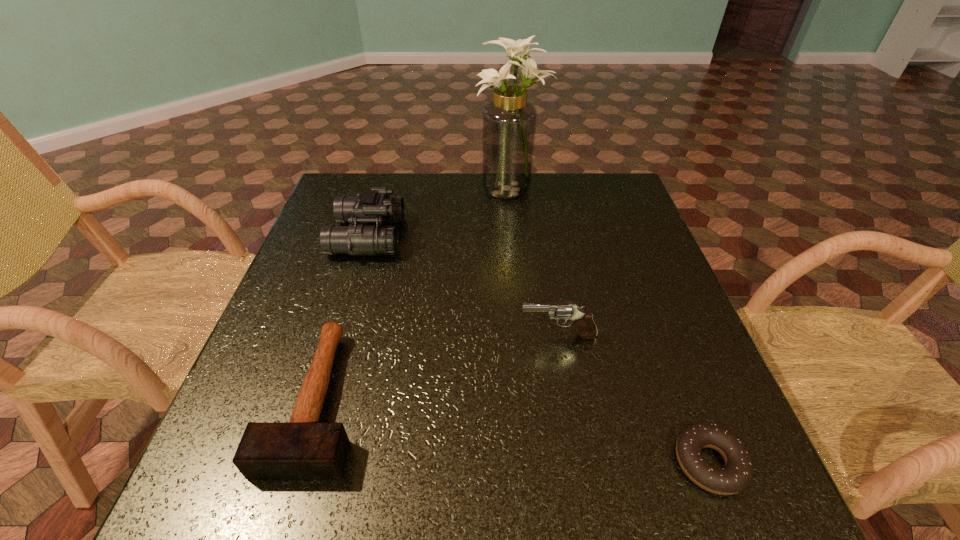
Image resolution: width=960 pixels, height=540 pixels. I want to click on free space located at the barrel of the pistol, so click(362, 336).

Identify the location of free location located at the barrel of the pistol. (386, 336).

Where is `free location located 0.240m at the barrel of the pistol`? This screenshot has height=540, width=960. free location located 0.240m at the barrel of the pistol is located at coordinates (405, 336).

This screenshot has height=540, width=960. I want to click on vacant space located 0.060m on the hammer head face of the mallet, so 281,521.

I want to click on free space located on the left of the rightmost object, so click(431, 463).

Identify the location of flower arrangement at the far edge. (509, 121).

Image resolution: width=960 pixels, height=540 pixels. I want to click on binoculars at the far edge, so click(x=375, y=206).

Where is `mallet situated at the near edge`? The width and height of the screenshot is (960, 540). mallet situated at the near edge is located at coordinates (303, 448).

Where is `doughnut that is positioned at the near edge`? The width and height of the screenshot is (960, 540). doughnut that is positioned at the near edge is located at coordinates (736, 475).

You are a GUI agent. You are given a task and a screenshot of the screen. Output one action in this format:
    pyautogui.click(x=<x>, y=<y>)
    Task: Click on the binoculars located in the left edge section of the desktop
    The width and height of the screenshot is (960, 540).
    Given the screenshot: What is the action you would take?
    pyautogui.click(x=375, y=206)